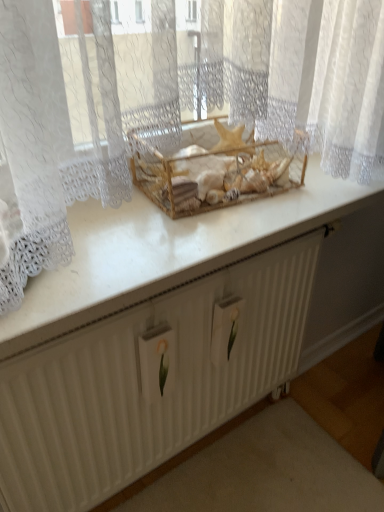
At what (x,y) coordinates should I click in order to perform the action: click on white textured radiator at center. Please return your answer as a coordinate pair (x, y). Looking at the image, I should click on (144, 382).

Measure the distance between wooden crate at center and camera.

The depth of wooden crate at center is 30.60 inches.

Where is `white glossy counter top at center`? The image size is (384, 512). white glossy counter top at center is located at coordinates (165, 252).

Consider the image. Is white textured radiator at center inside white glossy counter top at center?

That's incorrect, white textured radiator at center is not inside white glossy counter top at center.

Which object is positioned more to the left, white glossy counter top at center or white textured radiator at center?

From the viewer's perspective, white textured radiator at center appears more on the left side.

Image resolution: width=384 pixels, height=512 pixels. I want to click on counter top located above the white textured radiator at center (from the image's perspective), so click(x=165, y=252).

From the image's perspective, is wooden crate at center positioned above or below white glossy counter top at center?

From the image's perspective, wooden crate at center appears above white glossy counter top at center.

Does wooden crate at center have a larger size compared to white glossy counter top at center?

No.

From a real-world perspective, is wooden crate at center positioned above or below white glossy counter top at center?

Clearly, from a real-world perspective, wooden crate at center is above white glossy counter top at center.

Is point (289, 185) closer or farther from the camera than point (236, 247)?

Point (289, 185) is positioned farther from the camera compared to point (236, 247).

From a real-world perspective, which is physically below, white textured radiator at center or white glossy counter top at center?

white textured radiator at center.

Between white textured radiator at center and white glossy counter top at center, which one has larger size?

With larger size is white textured radiator at center.

How distant is white textured radiator at center from white glossy counter top at center?

A distance of 11.13 inches exists between white textured radiator at center and white glossy counter top at center.

Is white textured radiator at center oriented towards white glossy counter top at center?

No, white textured radiator at center is not aimed at white glossy counter top at center.

Between point (169, 190) and point (301, 294), which one is positioned behind?

Positioned behind is point (301, 294).

How far apart are wooden crate at center and white textured radiator at center?

wooden crate at center and white textured radiator at center are 15.13 inches apart.

Is wooden crate at center oriented towards white textured radiator at center?

No, wooden crate at center is not facing towards white textured radiator at center.

The width and height of the screenshot is (384, 512). In the image, there is a wooden crate at center. Identify the location of radiator below it (from the image's perspective). (144, 382).

Which is further, (309, 173) or (189, 184)?

The point (309, 173) is farther from the camera.

Is white glossy counter top at center beside wooden crate at center?

white glossy counter top at center and wooden crate at center are not in contact.

Is white glossy counter top at center spatially inside wooden crate at center, or outside of it?

white glossy counter top at center is not enclosed by wooden crate at center.

Is wooden crate at center at the back of white glossy counter top at center?

white glossy counter top at center does not have its back to wooden crate at center.

Does white textured radiator at center lie behind wooden crate at center?

No, the depth of white textured radiator at center is less than that of wooden crate at center.

Between white textured radiator at center and wooden crate at center, which one has larger size?

With larger size is white textured radiator at center.

Is white textured radiator at center positioned with its back to wooden crate at center?

No, white textured radiator at center is not facing away from wooden crate at center.

Locate an element on the screen. radiator behind the white glossy counter top at center is located at coordinates (144, 382).

At what (x,y) coordinates should I click in order to perform the action: click on counter top in front of the wooden crate at center. Please return your answer as a coordinate pair (x, y). The image size is (384, 512). Looking at the image, I should click on (165, 252).

Which object lies nearer to the anchor point white textured radiator at center, wooden crate at center or white glossy counter top at center?

The object closer to white textured radiator at center is white glossy counter top at center.

In the scene shown: Considering their positions, is white glossy counter top at center positioned closer to white textured radiator at center than wooden crate at center?

white glossy counter top at center lies closer to white textured radiator at center than the other object.

When comparing their distances from white glossy counter top at center, does white textured radiator at center or wooden crate at center seem closer?

The object closer to white glossy counter top at center is wooden crate at center.

Considering their positions, is wooden crate at center positioned further to white glossy counter top at center than white textured radiator at center?

Among the two, white textured radiator at center is located further to white glossy counter top at center.

When comparing their distances from wooden crate at center, does white textured radiator at center or white glossy counter top at center seem closer?

white glossy counter top at center is closer to wooden crate at center.

From the image, which object appears to be nearer to wooden crate at center, white glossy counter top at center or white textured radiator at center?

Among the two, white glossy counter top at center is located nearer to wooden crate at center.

Locate an element on the screen. The height and width of the screenshot is (512, 384). counter top between wooden crate at center and white textured radiator at center vertically is located at coordinates (165, 252).